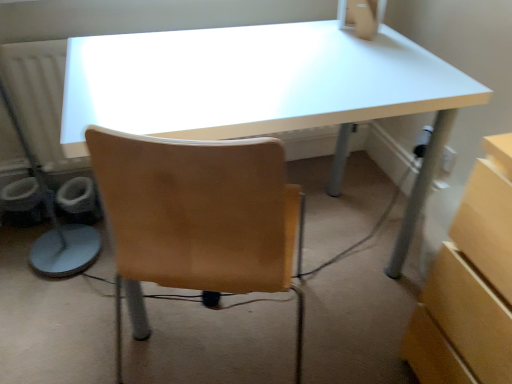
Question: Can matte beige desktop computer at upper center be found inside white glossy desk at center?

Choices:
 (A) yes
 (B) no

Answer: (B)

Question: Is white glossy desk at center not near matte beige desktop computer at upper center?

Choices:
 (A) yes
 (B) no

Answer: (B)

Question: From the image's perspective, would you say white glossy desk at center is shown under matte beige desktop computer at upper center?

Choices:
 (A) no
 (B) yes

Answer: (B)

Question: Is white glossy desk at center thinner than matte beige desktop computer at upper center?

Choices:
 (A) no
 (B) yes

Answer: (A)

Question: Can you confirm if white glossy desk at center is bigger than matte beige desktop computer at upper center?

Choices:
 (A) no
 (B) yes

Answer: (B)

Question: Is white glossy desk at center at the left side of matte beige desktop computer at upper center?

Choices:
 (A) yes
 (B) no

Answer: (A)

Question: Does matte beige desktop computer at upper center have a lesser width compared to white glossy desk at center?

Choices:
 (A) yes
 (B) no

Answer: (A)

Question: Is matte beige desktop computer at upper center next to white glossy desk at center?

Choices:
 (A) yes
 (B) no

Answer: (B)

Question: Can we say matte beige desktop computer at upper center lies outside white glossy desk at center?

Choices:
 (A) no
 (B) yes

Answer: (B)

Question: Does matte beige desktop computer at upper center have a smaller size compared to white glossy desk at center?

Choices:
 (A) no
 (B) yes

Answer: (B)

Question: Is matte beige desktop computer at upper center to the left of white glossy desk at center from the viewer's perspective?

Choices:
 (A) yes
 (B) no

Answer: (B)

Question: Considering the relative sizes of matte beige desktop computer at upper center and white glossy desk at center in the image provided, is matte beige desktop computer at upper center bigger than white glossy desk at center?

Choices:
 (A) yes
 (B) no

Answer: (B)

Question: Considering their positions, is white glossy desk at center located in front of or behind matte beige desktop computer at upper center?

Choices:
 (A) front
 (B) behind

Answer: (A)